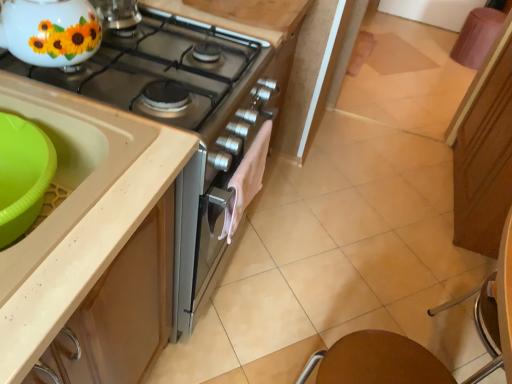
Question: Is metallic silver chair at lower right not inside white glossy teapot at upper left?

Choices:
 (A) yes
 (B) no

Answer: (A)

Question: Is metallic silver chair at lower right at the left side of white glossy teapot at upper left?

Choices:
 (A) no
 (B) yes

Answer: (A)

Question: From a real-world perspective, is metallic silver chair at lower right physically above white glossy teapot at upper left?

Choices:
 (A) no
 (B) yes

Answer: (A)

Question: Is white glossy teapot at upper left located within metallic silver chair at lower right?

Choices:
 (A) yes
 (B) no

Answer: (B)

Question: Is metallic silver chair at lower right touching white glossy teapot at upper left?

Choices:
 (A) yes
 (B) no

Answer: (B)

Question: From a real-world perspective, is pink fabric bar stool at upper right above or below green plastic sink at lower left, the 2th sink viewed from the front?

Choices:
 (A) below
 (B) above

Answer: (A)

Question: Considering their positions, is pink fabric bar stool at upper right located in front of or behind green plastic sink at lower left, positioned as the 1th sink in back-to-front order?

Choices:
 (A) front
 (B) behind

Answer: (B)

Question: Is pink fabric bar stool at upper right bigger or smaller than green plastic sink at lower left, the 2th sink viewed from the front?

Choices:
 (A) small
 (B) big

Answer: (B)

Question: Looking at their shapes, would you say pink fabric bar stool at upper right is wider or thinner than green plastic sink at lower left, positioned as the 1th sink in back-to-front order?

Choices:
 (A) thin
 (B) wide

Answer: (B)

Question: Looking at the image, does white glossy teapot at upper left seem bigger or smaller compared to brown matte table at lower right?

Choices:
 (A) big
 (B) small

Answer: (B)

Question: Is white glossy teapot at upper left wider or thinner than brown matte table at lower right?

Choices:
 (A) thin
 (B) wide

Answer: (A)

Question: Is point (33, 56) positioned closer to the camera than point (441, 375)?

Choices:
 (A) closer
 (B) farther

Answer: (A)

Question: From a real-world perspective, is white glossy teapot at upper left positioned above or below brown matte table at lower right?

Choices:
 (A) above
 (B) below

Answer: (A)

Question: Considering the positions of green plastic sink at lower left, positioned as the 1th sink in back-to-front order, and brown matte table at lower right in the image, is green plastic sink at lower left, positioned as the 1th sink in back-to-front order, bigger or smaller than brown matte table at lower right?

Choices:
 (A) big
 (B) small

Answer: (B)

Question: In terms of width, does green plastic sink at lower left, positioned as the 1th sink in back-to-front order, look wider or thinner when compared to brown matte table at lower right?

Choices:
 (A) thin
 (B) wide

Answer: (A)